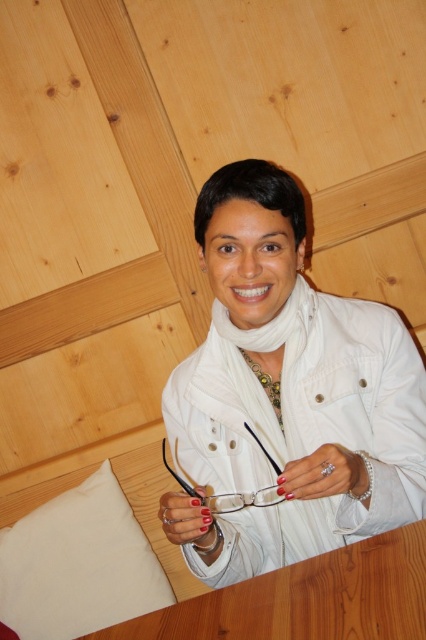
Does white matte jacket at center appear over wooden table at center?

Correct, white matte jacket at center is located above wooden table at center.

Based on the photo, between white matte jacket at center and wooden table at center, which one appears on the left side from the viewer's perspective?

wooden table at center is more to the left.

Where is `white matte jacket at center`? This screenshot has width=426, height=640. white matte jacket at center is located at coordinates (301, 428).

Is white fabric pillow at lower left thinner than nail polish at center?

No.

Can you confirm if white fabric pillow at lower left is positioned below nail polish at center?

Yes, white fabric pillow at lower left is below nail polish at center.

What do you see at coordinates (78, 564) in the screenshot? Image resolution: width=426 pixels, height=640 pixels. I see `white fabric pillow at lower left` at bounding box center [78, 564].

This screenshot has height=640, width=426. What are the coordinates of `white fabric pillow at lower left` in the screenshot? It's located at (78, 564).

Is pearl bracelet at lower center wider than nail polish at center?

Indeed, pearl bracelet at lower center has a greater width compared to nail polish at center.

The width and height of the screenshot is (426, 640). In order to click on pearl bracelet at lower center in this screenshot , I will do `click(324, 474)`.